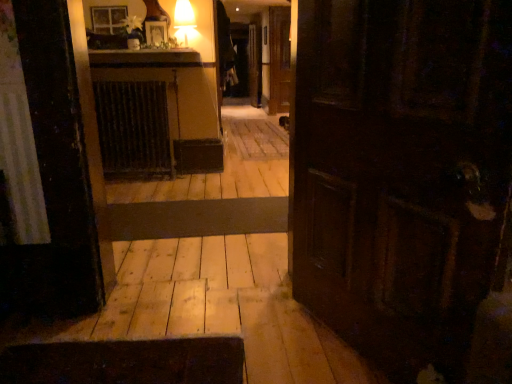
Question: Considering their positions, is wooden floor at center located in front of or behind dark brown metal radiator at center?

Choices:
 (A) front
 (B) behind

Answer: (A)

Question: Based on their positions, is wooden floor at center located to the left or right of dark brown metal radiator at center?

Choices:
 (A) left
 (B) right

Answer: (B)

Question: From their relative heights in the image, would you say wooden floor at center is taller or shorter than dark brown metal radiator at center?

Choices:
 (A) tall
 (B) short

Answer: (B)

Question: Is dark brown metal radiator at center bigger or smaller than wooden floor at center?

Choices:
 (A) big
 (B) small

Answer: (A)

Question: From a real-world perspective, is dark brown metal radiator at center above or below wooden floor at center?

Choices:
 (A) below
 (B) above

Answer: (B)

Question: Do you think dark brown metal radiator at center is within wooden floor at center, or outside of it?

Choices:
 (A) inside
 (B) outside

Answer: (B)

Question: Considering the positions of point (168, 173) and point (12, 372), is point (168, 173) closer or farther from the camera than point (12, 372)?

Choices:
 (A) closer
 (B) farther

Answer: (B)